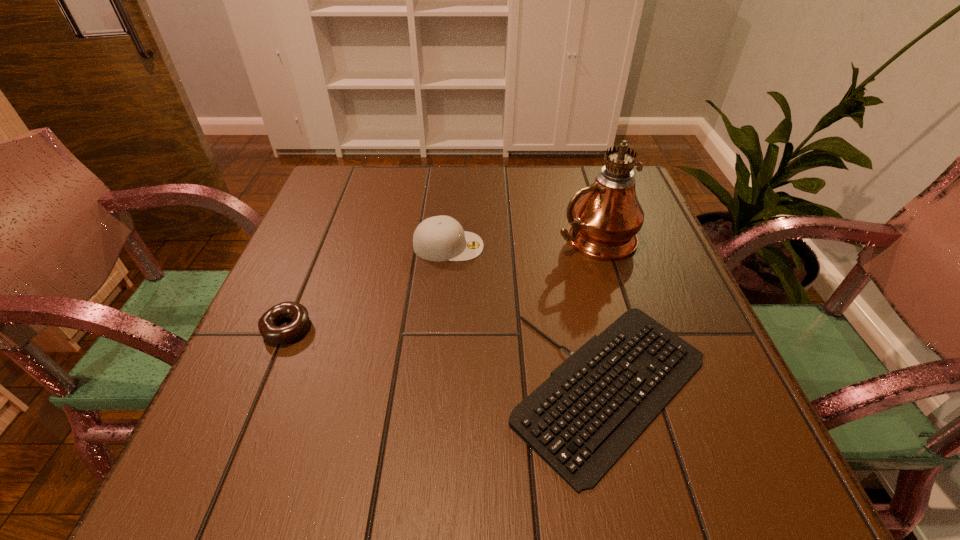
Locate an element on the screen. object located in the near edge section of the desktop is located at coordinates (594, 405).

What are the coordinates of `object that is at the left edge` in the screenshot? It's located at (267, 324).

Where is `oil lamp present at the right edge`? This screenshot has height=540, width=960. oil lamp present at the right edge is located at coordinates (605, 217).

Locate an element on the screen. This screenshot has height=540, width=960. computer keyboard present at the right edge is located at coordinates (594, 405).

The image size is (960, 540). Identify the location of object present at the near right corner. (594, 405).

Identify the location of free space at the far edge of the desktop. The height and width of the screenshot is (540, 960). (571, 184).

In the image, there is a desktop. Where is `vacant space at the left edge`? The height and width of the screenshot is (540, 960). vacant space at the left edge is located at coordinates (305, 233).

At what (x,y) coordinates should I click in order to perform the action: click on free location at the right edge of the desktop. Please return your answer as a coordinate pair (x, y). This screenshot has height=540, width=960. Looking at the image, I should click on (651, 309).

Where is `vacant space at the far left corner of the desktop`? This screenshot has height=540, width=960. vacant space at the far left corner of the desktop is located at coordinates (375, 170).

Identify the location of free location at the near right corner. The height and width of the screenshot is (540, 960). [739, 482].